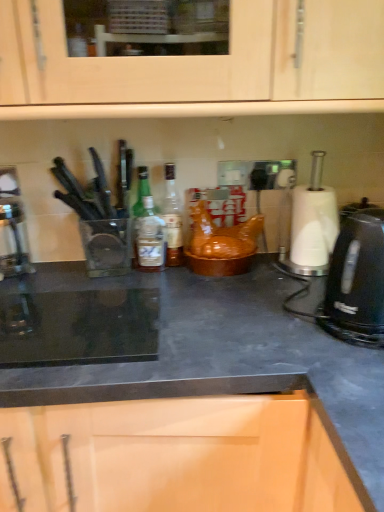
The width and height of the screenshot is (384, 512). What are the coordinates of `vacant space situated on the left part of green glass bottle at center` in the screenshot? It's located at (84, 269).